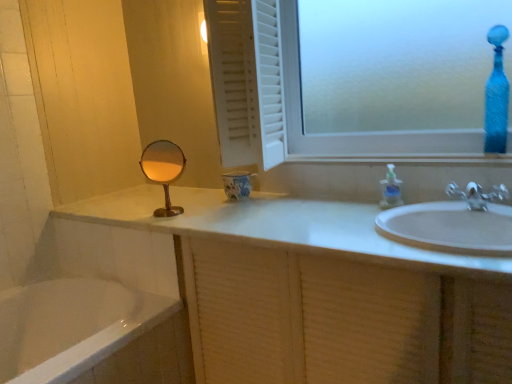
What do you see at coordinates (291, 96) in the screenshot? I see `frosted glass window at upper center` at bounding box center [291, 96].

Locate an element on the screen. This screenshot has width=512, height=384. gold metallic mirror at center is located at coordinates (163, 170).

The image size is (512, 384). What do you see at coordinates (321, 292) in the screenshot?
I see `white textured cabinet at lower right` at bounding box center [321, 292].

Measure the distance between point (x=251, y=354) and camera.

Point (x=251, y=354) is 5.06 feet away from camera.

This screenshot has height=384, width=512. Describe the element at coordinates (454, 223) in the screenshot. I see `white glossy sink at lower right` at that location.

What are the coordinates of `white glossy sink at upper center` in the screenshot? It's located at (406, 158).

Where is `frosted glass window at upper center`? The height and width of the screenshot is (384, 512). frosted glass window at upper center is located at coordinates (291, 96).

Are gold metallic mirror at center and white glossy sink at upper center located far from each other?

That's not correct — gold metallic mirror at center is a little close to white glossy sink at upper center.

Does gold metallic mirror at center appear on the right side of white glossy sink at upper center?

In fact, gold metallic mirror at center is to the left of white glossy sink at upper center.

From the picture: Can you confirm if gold metallic mirror at center is shorter than white glossy sink at upper center?

Incorrect, the height of gold metallic mirror at center does not fall short of that of white glossy sink at upper center.

In terms of size, does gold metallic mirror at center appear bigger or smaller than white glossy sink at upper center?

Clearly, gold metallic mirror at center is smaller in size than white glossy sink at upper center.

Is white glossy sink at lower right turned away from translucent plastic soap dispenser at upper right?

white glossy sink at lower right is not turned away from translucent plastic soap dispenser at upper right.

From the image's perspective, which one is positioned higher, white glossy sink at lower right or translucent plastic soap dispenser at upper right?

translucent plastic soap dispenser at upper right is shown above in the image.

Based on the photo, relative to translucent plastic soap dispenser at upper right, is white glossy sink at lower right in front or behind?

white glossy sink at lower right is positioned closer to the viewer than translucent plastic soap dispenser at upper right.

Does white glossy sink at lower right have a greater width compared to translucent plastic soap dispenser at upper right?

Correct, the width of white glossy sink at lower right exceeds that of translucent plastic soap dispenser at upper right.

Is white glossy sink at lower right inside the boundaries of white glossy bathtub at lower left, or outside?

white glossy sink at lower right is outside white glossy bathtub at lower left.

Based on the photo, which is behind, white glossy sink at lower right or white glossy bathtub at lower left?

white glossy bathtub at lower left is further away from the camera.

Between white glossy sink at lower right and white glossy bathtub at lower left, which one has larger width?

white glossy bathtub at lower left is wider.

Can you confirm if white glossy sink at lower right is shorter than white glossy bathtub at lower left?

Correct, white glossy sink at lower right is not as tall as white glossy bathtub at lower left.

Based on the photo, from the image's perspective, between frosted glass window at upper center and white textured cabinet at lower right, who is located below?

white textured cabinet at lower right, from the image's perspective.

Is frosted glass window at upper center further to camera compared to white textured cabinet at lower right?

Yes.

Considering the points (289, 89) and (211, 189), which point is behind, point (289, 89) or point (211, 189)?

Positioned behind is point (211, 189).

Which of these two, frosted glass window at upper center or white textured cabinet at lower right, is thinner?

frosted glass window at upper center.

Considering the relative positions of white glossy sink at upper center and blue textured glass vase at upper right in the image provided, is white glossy sink at upper center in front of blue textured glass vase at upper right?

Yes, it is in front of blue textured glass vase at upper right.

Based on their sizes in the image, would you say white glossy sink at upper center is bigger or smaller than blue textured glass vase at upper right?

white glossy sink at upper center is bigger than blue textured glass vase at upper right.

From the image's perspective, would you say white glossy sink at upper center is positioned over blue textured glass vase at upper right?

No, from the image's perspective, white glossy sink at upper center is not above blue textured glass vase at upper right.

In the image, there is a blue textured glass vase at upper right. Where is `window sill below it (from the image's perspective)`? This screenshot has width=512, height=384. window sill below it (from the image's perspective) is located at coordinates (406, 158).

Is white glossy bathtub at lower left beside white glossy sink at lower right?

No, white glossy bathtub at lower left is not beside white glossy sink at lower right.

From the image's perspective, relative to white glossy sink at lower right, is white glossy bathtub at lower left above or below?

Clearly, from the image's perspective, white glossy bathtub at lower left is below white glossy sink at lower right.

Is white glossy bathtub at lower left facing towards white glossy sink at lower right?

Yes, white glossy bathtub at lower left faces towards white glossy sink at lower right.

Is point (156, 315) closer or farther from the camera than point (473, 238)?

Point (156, 315) is positioned farther from the camera compared to point (473, 238).

Considering the sizes of blue textured glass vase at upper right and white glossy sink at upper center in the image, is blue textured glass vase at upper right bigger or smaller than white glossy sink at upper center?

Considering their sizes, blue textured glass vase at upper right takes up less space than white glossy sink at upper center.

From the image's perspective, is blue textured glass vase at upper right above or below white glossy sink at upper center?

Clearly, from the image's perspective, blue textured glass vase at upper right is above white glossy sink at upper center.

Is blue textured glass vase at upper right to the left or to the right of white glossy sink at upper center in the image?

blue textured glass vase at upper right is to the right of white glossy sink at upper center.

Is blue textured glass vase at upper right positioned with its back to white glossy sink at upper center?

No, white glossy sink at upper center is not at the back of blue textured glass vase at upper right.

Where is `window sill that is in front of the gold metallic mirror at center`? window sill that is in front of the gold metallic mirror at center is located at coordinates pos(406,158).

At what (x,y) coordinates should I click in order to perform the action: click on sink that appears on the right of translucent plastic soap dispenser at upper right. Please return your answer as a coordinate pair (x, y). Looking at the image, I should click on (454, 223).

Considering their positions, is white glossy sink at upper center positioned closer to frosted glass window at upper center than blue textured glass vase at upper right?

Among the two, white glossy sink at upper center is located nearer to frosted glass window at upper center.

Estimate the real-world distances between objects in this image. Which object is closer to white glossy sink at lower right, white glossy sink at upper center or gold metallic mirror at center?

Based on the image, white glossy sink at upper center appears to be nearer to white glossy sink at lower right.

Looking at the image, which one is located further to silver metallic faucet at right, white glossy sink at upper center or white textured cabinet at lower right?

Based on the image, white textured cabinet at lower right appears to be further to silver metallic faucet at right.

Which object lies further to the anchor point gold metallic mirror at center, frosted glass window at upper center or white glossy bathtub at lower left?

frosted glass window at upper center.

Considering their positions, is gold metallic mirror at center positioned further to frosted glass window at upper center than silver metallic faucet at right?

silver metallic faucet at right.

Looking at the image, which one is located further to translucent plastic soap dispenser at upper right, silver metallic faucet at right or frosted glass window at upper center?

Based on the image, frosted glass window at upper center appears to be further to translucent plastic soap dispenser at upper right.

Based on their spatial positions, is translucent plastic soap dispenser at upper right or white glossy sink at lower right further from white glossy bathtub at lower left?

The object further to white glossy bathtub at lower left is translucent plastic soap dispenser at upper right.

From the image, which object appears to be nearer to silver metallic faucet at right, frosted glass window at upper center or white glossy sink at upper center?

white glossy sink at upper center is closer to silver metallic faucet at right.

The image size is (512, 384). I want to click on sink between white glossy bathtub at lower left and blue textured glass vase at upper right from left to right, so click(454, 223).

You are a GUI agent. You are given a task and a screenshot of the screen. Output one action in this format:
    pyautogui.click(x=<x>, y=<y>)
    Task: Click on the sink between frosted glass window at upper center and white textured cabinet at lower right vertically
    The height and width of the screenshot is (384, 512).
    Given the screenshot: What is the action you would take?
    pyautogui.click(x=454, y=223)

The height and width of the screenshot is (384, 512). Find the location of `tap between blue textured glass vase at upper right and white textured cabinet at lower right in the up-down direction`. tap between blue textured glass vase at upper right and white textured cabinet at lower right in the up-down direction is located at coordinates (477, 195).

Find the location of a particular element. soap dispenser situated between white glossy bathtub at lower left and white glossy sink at upper center from left to right is located at coordinates (391, 190).